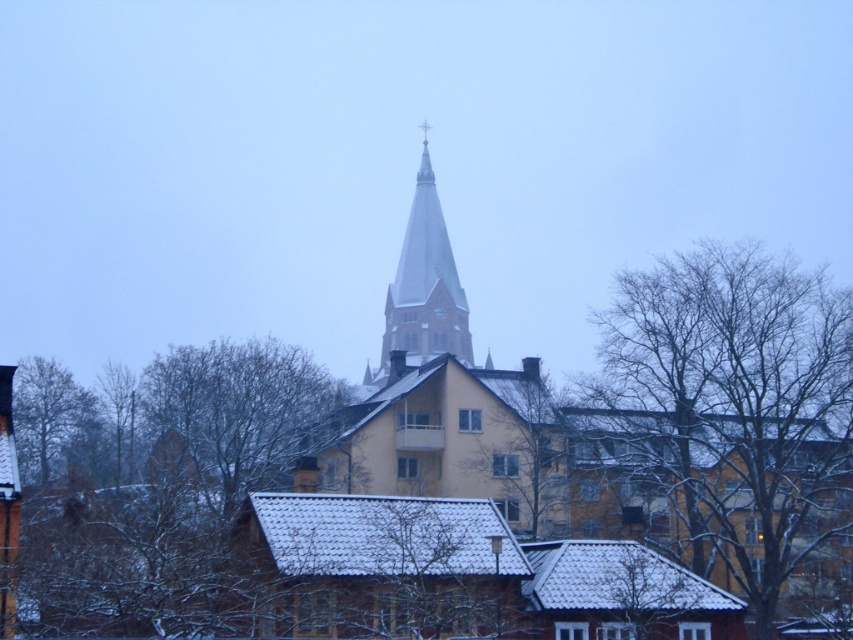
Question: Considering the relative positions of bare branches at center and green leafy tree at lower left in the image provided, where is bare branches at center located with respect to green leafy tree at lower left?

Choices:
 (A) below
 (B) above

Answer: (B)

Question: Does bare branches at upper center appear on the left side of bare branches at center?

Choices:
 (A) yes
 (B) no

Answer: (B)

Question: Which object appears closest to the camera in this image?

Choices:
 (A) smooth gray steeple at center
 (B) green leafy tree at lower left
 (C) bare branches at center

Answer: (B)

Question: Which of these objects is positioned closest to the smooth gray steeple at center?

Choices:
 (A) bare branches at center
 (B) bare branches at upper center
 (C) green leafy tree at lower left

Answer: (A)

Question: Does bare branches at center have a smaller size compared to smooth gray steeple at center?

Choices:
 (A) no
 (B) yes

Answer: (B)

Question: Among these points, which one is farthest from the camera?

Choices:
 (A) (498, 380)
 (B) (45, 364)
 (C) (463, 321)

Answer: (C)